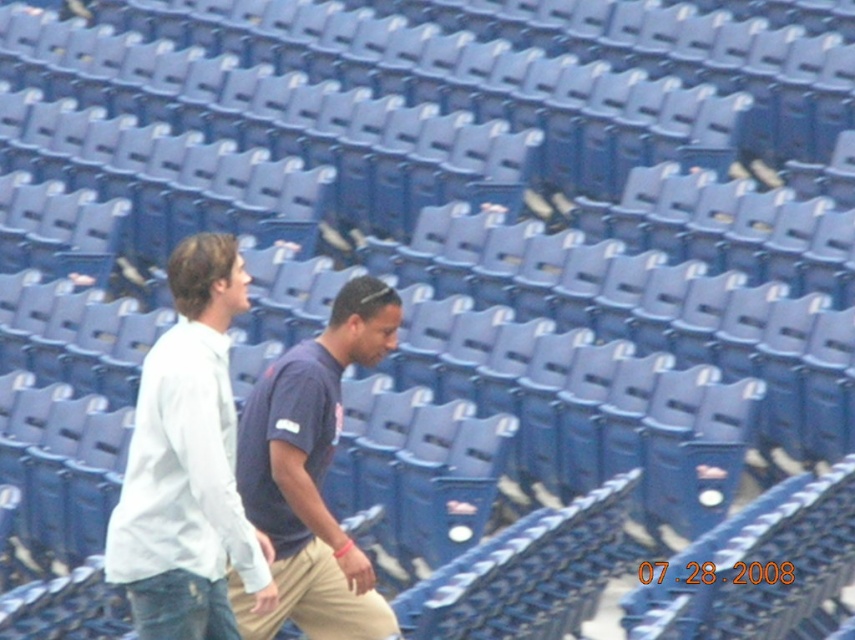
Question: Is white cotton shirt at center in front of dark blue t-shirt at center?

Choices:
 (A) no
 (B) yes

Answer: (B)

Question: Can you confirm if white cotton shirt at center is positioned to the left of dark blue t-shirt at center?

Choices:
 (A) yes
 (B) no

Answer: (A)

Question: Considering the relative positions of white cotton shirt at center and dark blue t-shirt at center in the image provided, where is white cotton shirt at center located with respect to dark blue t-shirt at center?

Choices:
 (A) right
 (B) left

Answer: (B)